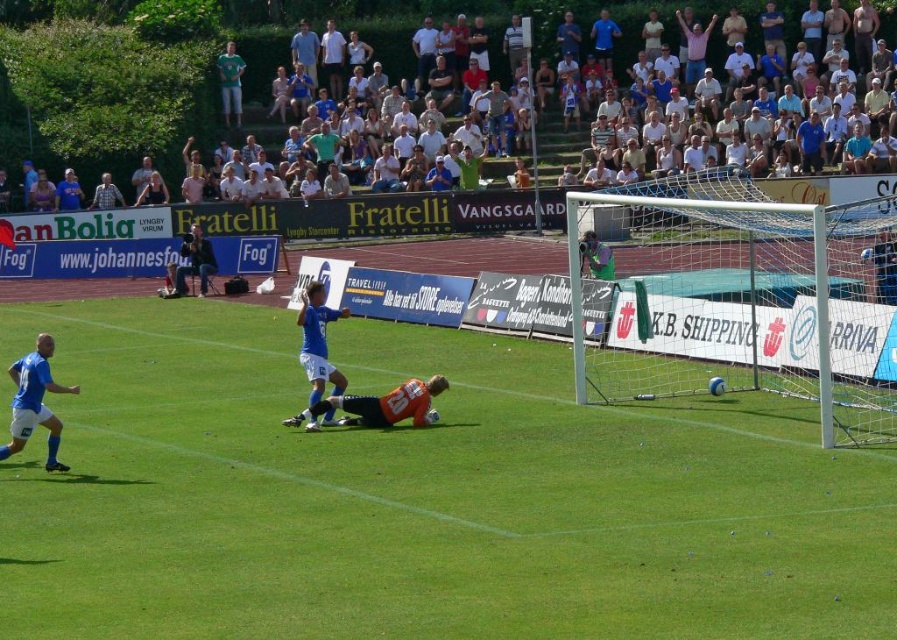
Question: Which point appears farthest from the camera in this image?

Choices:
 (A) (799, 440)
 (B) (420, 388)

Answer: (B)

Question: Can you confirm if blue jersey at left is positioned above green jersey at upper center?

Choices:
 (A) no
 (B) yes

Answer: (A)

Question: Is dark blue jacket at center closer to the viewer compared to green jersey at upper center?

Choices:
 (A) no
 (B) yes

Answer: (B)

Question: Which point is farther from the camera taking this photo?

Choices:
 (A) (727, 371)
 (B) (168, 68)
 (C) (120, 196)

Answer: (B)

Question: Can you confirm if green grass football field at center is positioned below dark blue jacket at center?

Choices:
 (A) no
 (B) yes

Answer: (B)

Question: Which point is farther to the camera?

Choices:
 (A) (46, 416)
 (B) (370, 417)
 (C) (675, 330)
 (D) (206, 250)

Answer: (D)